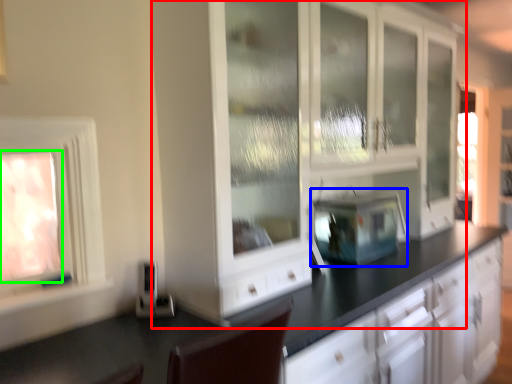
Question: Which is nearer to the cabinetry (highlighted by a red box)? appliance (highlighted by a blue box) or window (highlighted by a green box).

Choices:
 (A) appliance
 (B) window

Answer: (A)